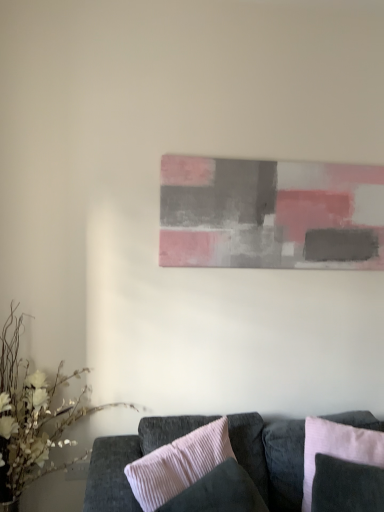
Image resolution: width=384 pixels, height=512 pixels. Describe the element at coordinates (270, 214) in the screenshot. I see `matte gray painting at center` at that location.

The image size is (384, 512). What do you see at coordinates (178, 464) in the screenshot?
I see `pink corduroy pillow at center, the 2th pillow when ordered from right to left` at bounding box center [178, 464].

Where is `white matte floral arrangement at lower left`? white matte floral arrangement at lower left is located at coordinates (32, 416).

From a real-world perspective, who is located higher, pink corduroy pillow at lower right, which is the 2th pillow in left-to-right order, or white matte floral arrangement at lower left?

white matte floral arrangement at lower left is physically above.

Does point (306, 493) come behind point (54, 432)?

No, it is in front of (54, 432).

Is pink corduroy pillow at lower right, which is the 1th pillow from right to left, not inside white matte floral arrangement at lower left?

Yes, pink corduroy pillow at lower right, which is the 1th pillow from right to left, is outside of white matte floral arrangement at lower left.

Is pink corduroy pillow at lower right, which is the 1th pillow from right to left, beside white matte floral arrangement at lower left?

There is a gap between pink corduroy pillow at lower right, which is the 1th pillow from right to left, and white matte floral arrangement at lower left.

Considering the positions of objects matte gray painting at center and pink corduroy pillow at lower right, which is the 2th pillow in left-to-right order, in the image provided, who is behind, matte gray painting at center or pink corduroy pillow at lower right, which is the 2th pillow in left-to-right order,?

matte gray painting at center is further from the camera.

Would you say matte gray painting at center is outside pink corduroy pillow at lower right, which is the 1th pillow from right to left?

Yes.

From the image's perspective, would you say velvet dark gray couch at lower center is positioned over white matte floral arrangement at lower left?

Incorrect, from the image's perspective, velvet dark gray couch at lower center is lower than white matte floral arrangement at lower left.

From the picture: Which object is thinner, velvet dark gray couch at lower center or white matte floral arrangement at lower left?

With smaller width is white matte floral arrangement at lower left.

Between point (259, 470) and point (25, 379), which one is positioned in front?

The point (259, 470) is closer.

Are pink corduroy pillow at lower right, which is the 1th pillow from right to left, and pink corduroy pillow at center, which ranks as the 1th pillow in left-to-right order, beside each other?

No, pink corduroy pillow at lower right, which is the 1th pillow from right to left, is not making contact with pink corduroy pillow at center, which ranks as the 1th pillow in left-to-right order.

Considering the sizes of objects pink corduroy pillow at lower right, which is the 1th pillow from right to left, and pink corduroy pillow at center, which ranks as the 1th pillow in left-to-right order, in the image provided, who is smaller, pink corduroy pillow at lower right, which is the 1th pillow from right to left, or pink corduroy pillow at center, which ranks as the 1th pillow in left-to-right order,?

pink corduroy pillow at lower right, which is the 1th pillow from right to left.

Is pink corduroy pillow at lower right, which is the 2th pillow in left-to-right order, shorter than pink corduroy pillow at center, which ranks as the 1th pillow in left-to-right order?

Correct, pink corduroy pillow at lower right, which is the 2th pillow in left-to-right order, is not as tall as pink corduroy pillow at center, which ranks as the 1th pillow in left-to-right order.

Could you measure the distance between pink corduroy pillow at lower right, which is the 1th pillow from right to left, and pink corduroy pillow at center, the 2th pillow when ordered from right to left?

pink corduroy pillow at lower right, which is the 1th pillow from right to left, and pink corduroy pillow at center, the 2th pillow when ordered from right to left, are 19.48 inches apart.

Which of these two, white matte floral arrangement at lower left or velvet dark gray couch at lower center, stands taller?

Answer: white matte floral arrangement at lower left is taller.

Does point (29, 386) appear closer or farther from the camera than point (269, 457)?

Point (29, 386).

Where is `floral arrangement above the velvet dark gray couch at lower center (from a real-world perspective)`? The width and height of the screenshot is (384, 512). floral arrangement above the velvet dark gray couch at lower center (from a real-world perspective) is located at coordinates (32, 416).

Is white matte floral arrangement at lower left to the left of velvet dark gray couch at lower center from the viewer's perspective?

Correct, you'll find white matte floral arrangement at lower left to the left of velvet dark gray couch at lower center.

From a real-world perspective, is velvet dark gray couch at lower center positioned above or below pink corduroy pillow at center, which ranks as the 1th pillow in left-to-right order?

velvet dark gray couch at lower center is situated lower than pink corduroy pillow at center, which ranks as the 1th pillow in left-to-right order, in the real world.

Between velvet dark gray couch at lower center and pink corduroy pillow at center, which ranks as the 1th pillow in left-to-right order, which one is positioned behind?

velvet dark gray couch at lower center is further from the camera.

Considering the sizes of objects velvet dark gray couch at lower center and pink corduroy pillow at center, the 2th pillow when ordered from right to left, in the image provided, who is smaller, velvet dark gray couch at lower center or pink corduroy pillow at center, the 2th pillow when ordered from right to left,?

pink corduroy pillow at center, the 2th pillow when ordered from right to left, is smaller.

Is velvet dark gray couch at lower center next to pink corduroy pillow at center, which ranks as the 1th pillow in left-to-right order, and touching it?

They are not placed beside each other.

Which object is wider, velvet dark gray couch at lower center or pink corduroy pillow at lower right, which is the 2th pillow in left-to-right order?

With larger width is velvet dark gray couch at lower center.

Which point is more distant from viewer, (100,475) or (383,442)?

The point (383,442) is farther.

Is velvet dark gray couch at lower center completely or partially outside of pink corduroy pillow at lower right, which is the 1th pillow from right to left?

Yes, velvet dark gray couch at lower center is located beyond the bounds of pink corduroy pillow at lower right, which is the 1th pillow from right to left.

Is velvet dark gray couch at lower center bigger than pink corduroy pillow at lower right, which is the 2th pillow in left-to-right order?

Correct, velvet dark gray couch at lower center is larger in size than pink corduroy pillow at lower right, which is the 2th pillow in left-to-right order.

This screenshot has height=512, width=384. I want to click on floral arrangement that appears on the left of pink corduroy pillow at lower right, which is the 1th pillow from right to left, so click(32, 416).

From the image's perspective, starting from the matte gray painting at center, which pillow is the 1st one below? Please provide its 2D coordinates.

[(337, 448)]

Estimate the real-world distances between objects in this image. Which object is further from velvet dark gray couch at lower center, white matte floral arrangement at lower left or pink corduroy pillow at center, which ranks as the 1th pillow in left-to-right order?

The object further to velvet dark gray couch at lower center is white matte floral arrangement at lower left.

When comparing their distances from pink corduroy pillow at lower right, which is the 2th pillow in left-to-right order, does pink corduroy pillow at center, which ranks as the 1th pillow in left-to-right order, or matte gray painting at center seem further?

matte gray painting at center.

Based on their spatial positions, is white matte floral arrangement at lower left or matte gray painting at center further from pink corduroy pillow at center, the 2th pillow when ordered from right to left?

Among the two, matte gray painting at center is located further to pink corduroy pillow at center, the 2th pillow when ordered from right to left.

When comparing their distances from pink corduroy pillow at lower right, which is the 2th pillow in left-to-right order, does pink corduroy pillow at center, the 2th pillow when ordered from right to left, or velvet dark gray couch at lower center seem closer?

Based on the image, velvet dark gray couch at lower center appears to be nearer to pink corduroy pillow at lower right, which is the 2th pillow in left-to-right order.

Estimate the real-world distances between objects in this image. Which object is closer to matte gray painting at center, pink corduroy pillow at center, the 2th pillow when ordered from right to left, or velvet dark gray couch at lower center?

The object closer to matte gray painting at center is velvet dark gray couch at lower center.

Based on their spatial positions, is matte gray painting at center or white matte floral arrangement at lower left further from velvet dark gray couch at lower center?

matte gray painting at center is positioned further to the anchor velvet dark gray couch at lower center.

Which object lies nearer to the anchor point velvet dark gray couch at lower center, pink corduroy pillow at center, which ranks as the 1th pillow in left-to-right order, or matte gray painting at center?

pink corduroy pillow at center, which ranks as the 1th pillow in left-to-right order, is closer to velvet dark gray couch at lower center.

Based on their spatial positions, is velvet dark gray couch at lower center or white matte floral arrangement at lower left closer to pink corduroy pillow at center, the 2th pillow when ordered from right to left?

velvet dark gray couch at lower center is positioned closer to the anchor pink corduroy pillow at center, the 2th pillow when ordered from right to left.

Find the location of a particular element. This screenshot has height=512, width=384. pillow between matte gray painting at center and pink corduroy pillow at center, which ranks as the 1th pillow in left-to-right order, from top to bottom is located at coordinates (337, 448).

You are a GUI agent. You are given a task and a screenshot of the screen. Output one action in this format:
    pyautogui.click(x=<x>, y=<y>)
    Task: Click on the studio couch between pink corduroy pillow at center, which ranks as the 1th pillow in left-to-right order, and pink corduroy pillow at lower right, which is the 2th pillow in left-to-right order, from left to right
    
    Given the screenshot: What is the action you would take?
    pyautogui.click(x=252, y=471)

In order to click on pillow situated between white matte floral arrangement at lower left and velvet dark gray couch at lower center from left to right in this screenshot , I will do `click(178, 464)`.

Locate an element on the screen. picture frame between white matte floral arrangement at lower left and pink corduroy pillow at lower right, which is the 1th pillow from right to left, in the horizontal direction is located at coordinates (270, 214).